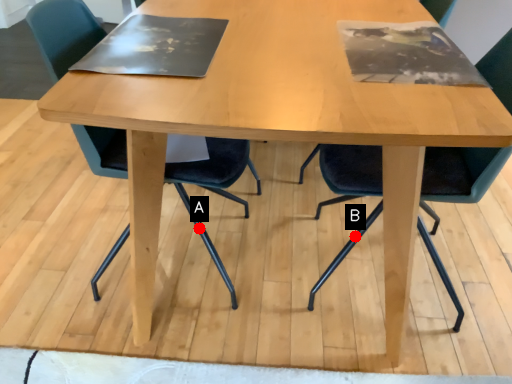
Question: Two points are circled on the image, labeled by A and B beside each circle. Which point is closer to the camera taking this photo?

Choices:
 (A) A is closer
 (B) B is closer

Answer: (A)